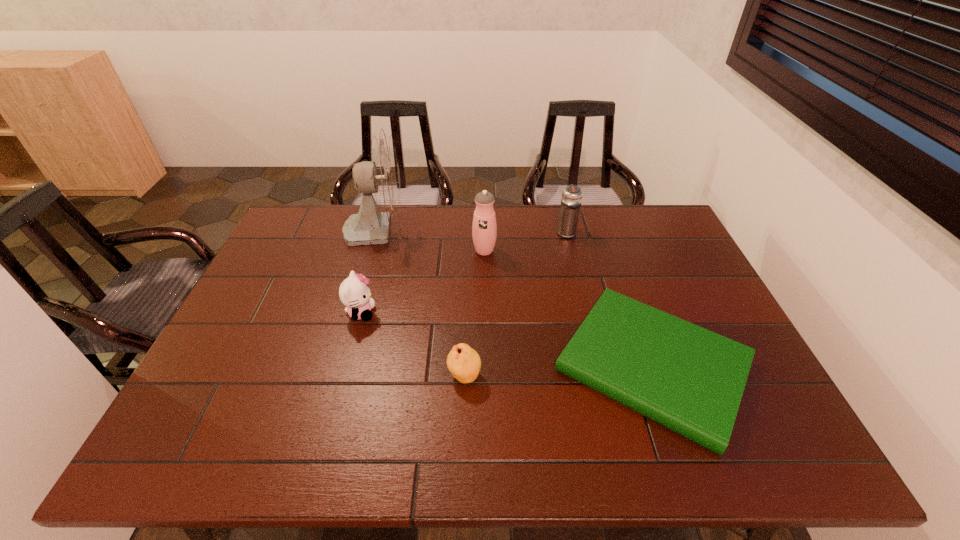
Locate an element on the screen. vacant space situated with a handle on the side of the right thermos bottle is located at coordinates (562, 215).

This screenshot has width=960, height=540. I want to click on blank area located with a handle on the side of the right thermos bottle, so click(560, 207).

This screenshot has width=960, height=540. What are the coordinates of `vacant area situated 0.070m with a handle on the side of the right thermos bottle` in the screenshot? It's located at (562, 213).

You are a GUI agent. You are given a task and a screenshot of the screen. Output one action in this format:
    pyautogui.click(x=<x>, y=<y>)
    Task: Click on the vacant region located on the front-facing side of the kitten
    This screenshot has width=960, height=540.
    Given the screenshot: What is the action you would take?
    pyautogui.click(x=480, y=313)

I want to click on free region located on the right of the second shortest object, so click(559, 376).

I want to click on free space located on the left of the paperback book, so pos(472,366).

This screenshot has height=540, width=960. In order to click on fan situated at the far edge in this screenshot , I will do `click(381, 176)`.

Identify the location of object that is positioned at the near edge. (690, 380).

You are a GUI agent. You are given a task and a screenshot of the screen. Output one action in this format:
    pyautogui.click(x=<x>, y=<y>)
    Task: Click on the object that is at the right edge
    Image resolution: width=960 pixels, height=540 pixels.
    Given the screenshot: What is the action you would take?
    pyautogui.click(x=690, y=380)

Identify the location of object located at the near right corner. (690, 380).